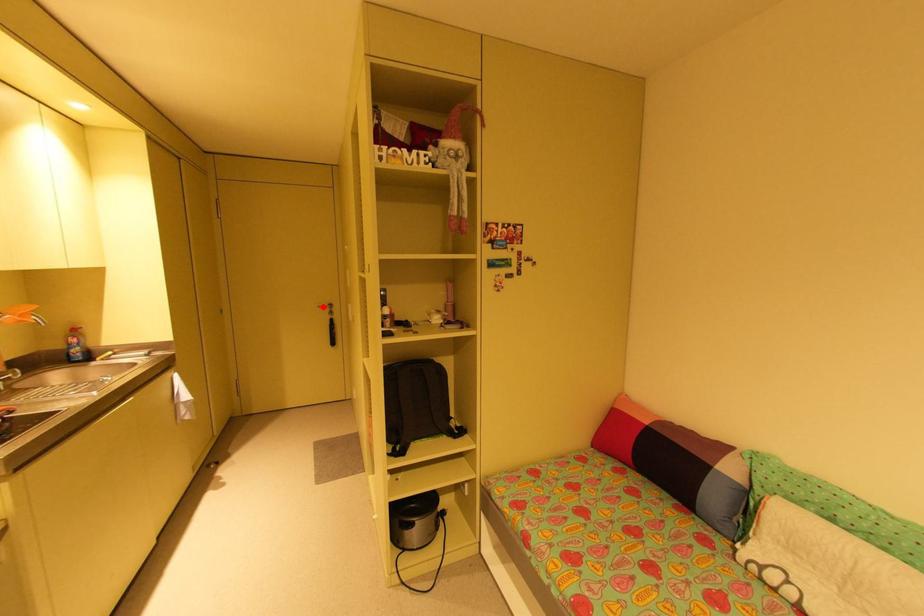
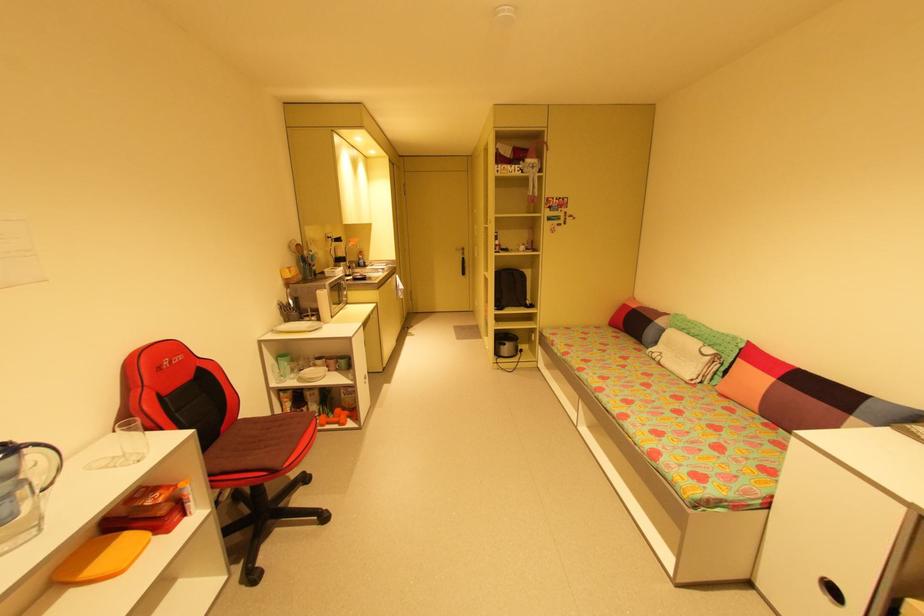
Question: I am providing you with two images of the same scene from different viewpoints. Given a red point in image1, look at the same physical point in image2. Is it:

Choices:
 (A) Closer to the viewpoint
 (B) Farther from the viewpoint

Answer: (A)